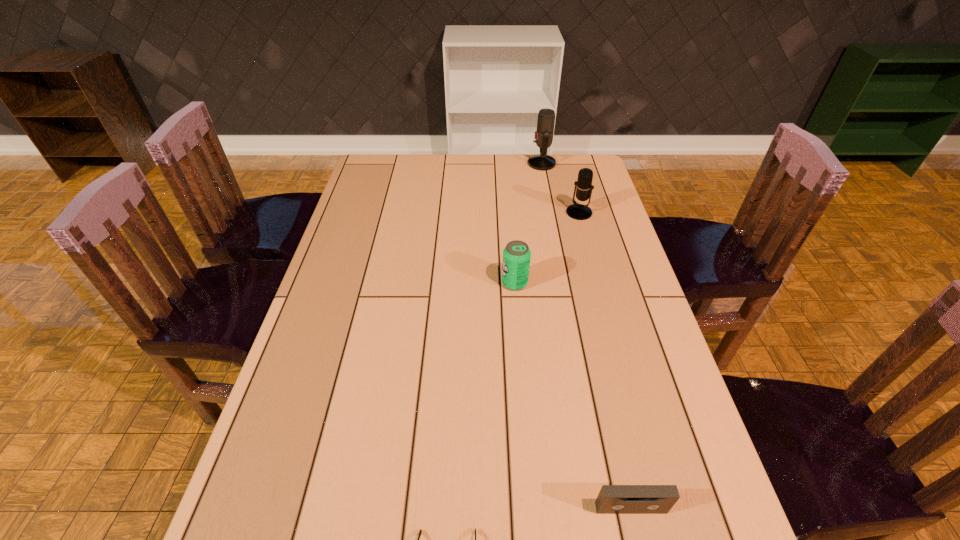
Find the location of a particular element. The image size is (960, 540). vacant space situated 0.110m on the side of the tallest object with the red ring is located at coordinates 500,164.

Locate an element on the screen. This screenshot has height=540, width=960. free space located 0.050m on the back of the second farthest object is located at coordinates coord(575,197).

Where is `vacant area situated 0.060m on the front-facing side of the pop soda`? vacant area situated 0.060m on the front-facing side of the pop soda is located at coordinates (480, 283).

In order to click on vacant space located 0.170m on the front-facing side of the pop soda in this screenshot , I will do `click(442, 283)`.

This screenshot has height=540, width=960. I want to click on vacant region located 0.220m on the front-facing side of the pop soda, so click(x=424, y=283).

Locate an element on the screen. This screenshot has height=540, width=960. object located in the far edge section of the desktop is located at coordinates (546, 117).

The image size is (960, 540). I want to click on videotape at the right edge, so click(612, 499).

The width and height of the screenshot is (960, 540). What are the coordinates of `object that is positioned at the far right corner` in the screenshot? It's located at (546, 117).

Where is `vacant space at the far edge`? The height and width of the screenshot is (540, 960). vacant space at the far edge is located at coordinates [514, 183].

Where is `vacant space at the left edge`? This screenshot has width=960, height=540. vacant space at the left edge is located at coordinates (372, 203).